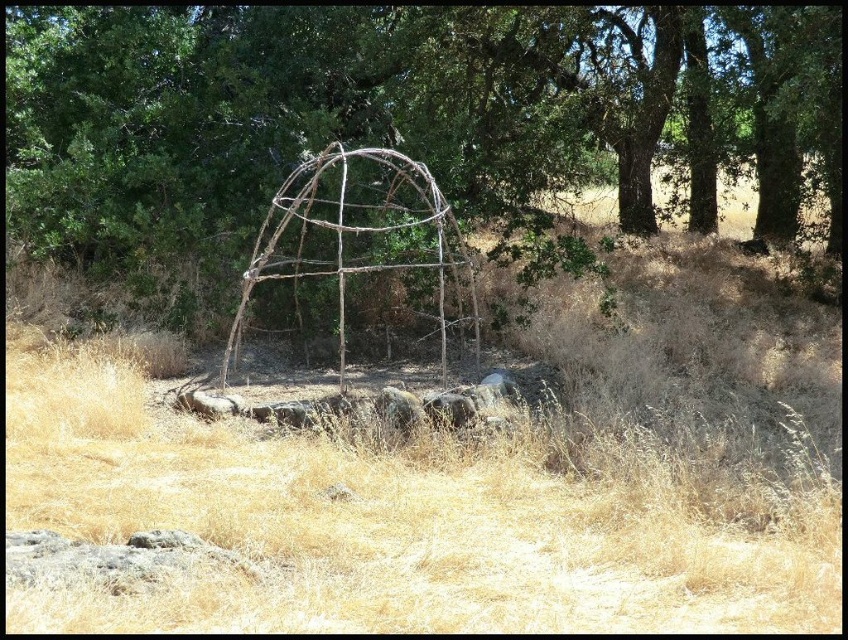
You are planning to place a large picnic blanket in the center of the brown wood structure at center and the brown rustic gazebo at center. Which structure can accommodate the blanket more comfortably?

The brown wood structure at center has a greater width than the brown rustic gazebo at center, so it can accommodate the picnic blanket more comfortably.

You are standing in a field and see the brown wood structure at center. If you want to reach it quickly, how many steps would you estimate to take?

The brown wood structure at center is 9.07 meters away from viewer. Assuming an average step length of about 0.76 meters, you would need approximately 12 steps to reach it.

You are a hiker trying to cross this area. You need to step on the dry grass at center and the brown wood structure at center. Which one is shorter so you can step on it easily?

The dry grass at center is shorter than the brown wood structure at center, so you can step on it easily.